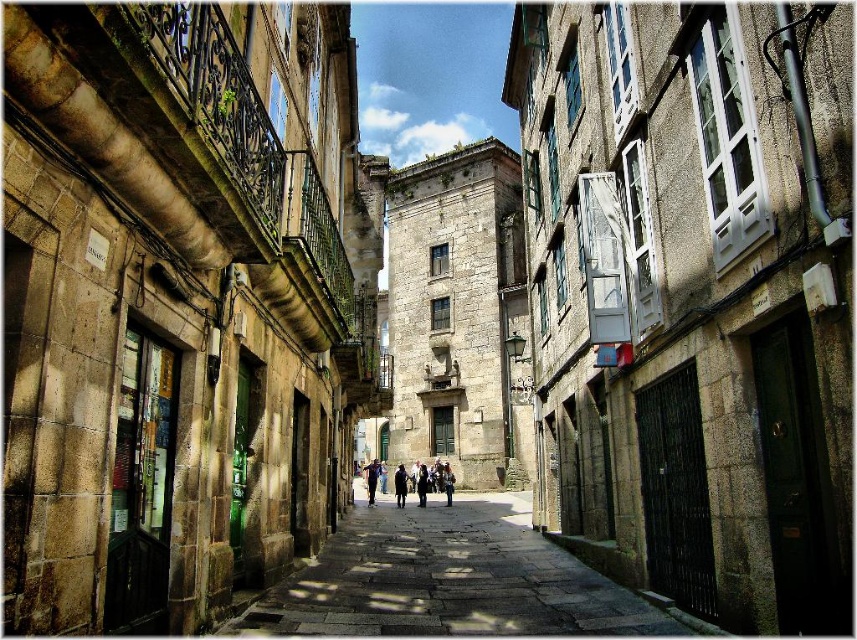
You are standing on the street looking at the historic buildings. There are two points marked on the buildings. One is at coordinate point (442,484) and the other is at point (369,497). Which point is closer to you?

Point (442,484) is closer to you because it is further to the viewer than point (369,497).